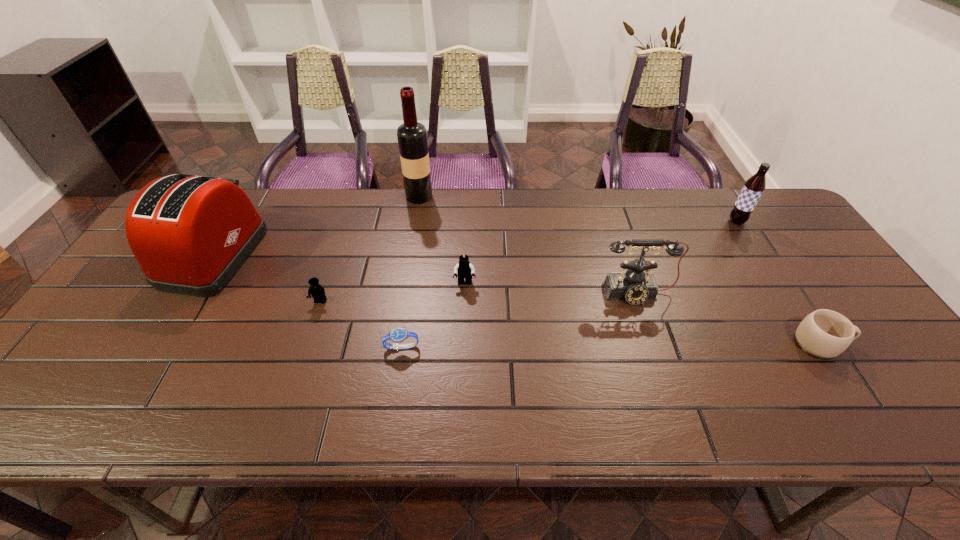
Where is `free area in between the mug and the watch`? This screenshot has width=960, height=540. free area in between the mug and the watch is located at coordinates (612, 346).

Locate an element on the screen. This screenshot has width=960, height=540. object that can be found as the fourth closest to the watch is located at coordinates (634, 286).

The height and width of the screenshot is (540, 960). In order to click on object that stands as the closest to the watch in this screenshot , I will do `click(464, 269)`.

Find the location of a particular element. Image resolution: width=960 pixels, height=540 pixels. vacant space that satisfies the following two spatial constraints: 1. on the front side of the toaster; 2. on the right side of the watch is located at coordinates (158, 347).